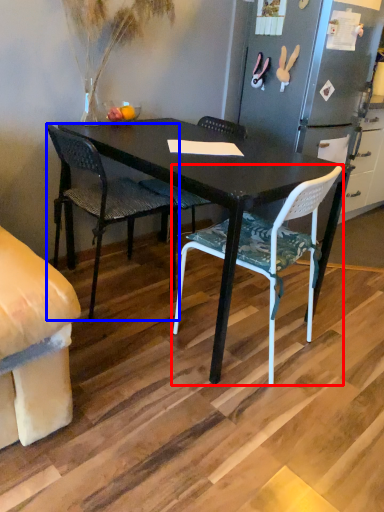
Question: Which object appears farthest to the camera in this image, chair (highlighted by a red box) or chair (highlighted by a blue box)?

Choices:
 (A) chair
 (B) chair

Answer: (B)